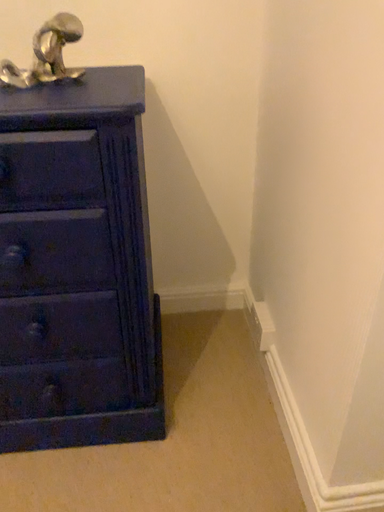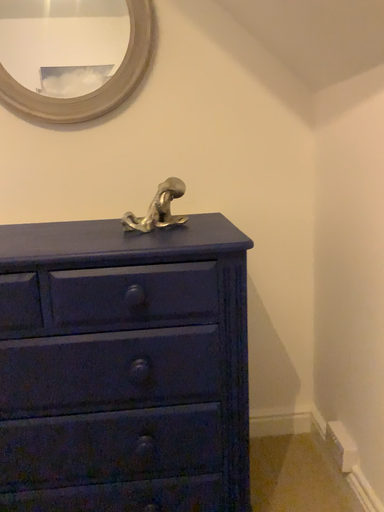
Question: Which way did the camera rotate in the video?

Choices:
 (A) rotated upward
 (B) rotated downward

Answer: (A)